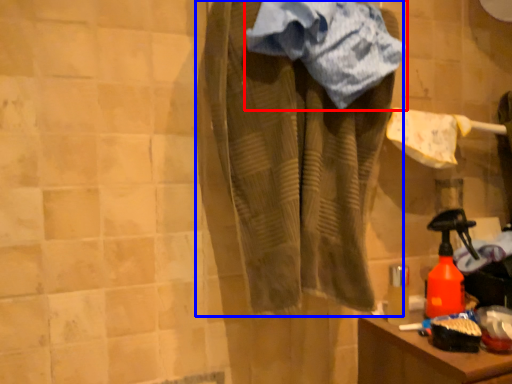
Question: Which object is closer to the camera taking this photo, towel (highlighted by a red box) or clothing (highlighted by a blue box)?

Choices:
 (A) towel
 (B) clothing

Answer: (B)